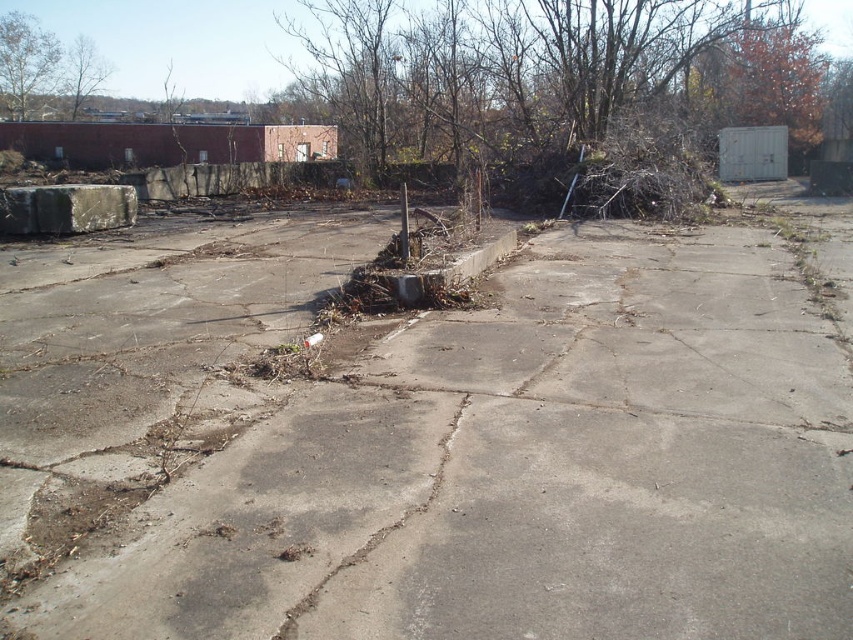
Who is positioned more to the left, brown/dry leaves at upper center or gray concrete block at left?

Positioned to the left is gray concrete block at left.

Is brown/dry leaves at upper center shorter than gray concrete block at left?

In fact, brown/dry leaves at upper center may be taller than gray concrete block at left.

The image size is (853, 640). What do you see at coordinates (547, 74) in the screenshot? I see `brown/dry leaves at upper center` at bounding box center [547, 74].

Find the location of a particular element. Image resolution: width=853 pixels, height=640 pixels. brown/dry leaves at upper center is located at coordinates (547, 74).

Which is behind, point (120, 209) or point (86, 49)?

Positioned behind is point (86, 49).

Is gray concrete block at left further to the viewer compared to brown leafy tree at upper left?

That is False.

Is point (122, 196) more distant than point (77, 84)?

No.

Find the location of a particular element. gray concrete block at left is located at coordinates (67, 209).

Is brown/dry leaves at upper center wider than green leafy tree at upper left?

Indeed, brown/dry leaves at upper center has a greater width compared to green leafy tree at upper left.

Which of these two, brown/dry leaves at upper center or green leafy tree at upper left, stands taller?

brown/dry leaves at upper center is taller.

Who is more distant from viewer, (352, 81) or (51, 60)?

The point (51, 60) is more distant.

Locate an element on the screen. The image size is (853, 640). brown/dry leaves at upper center is located at coordinates (547, 74).